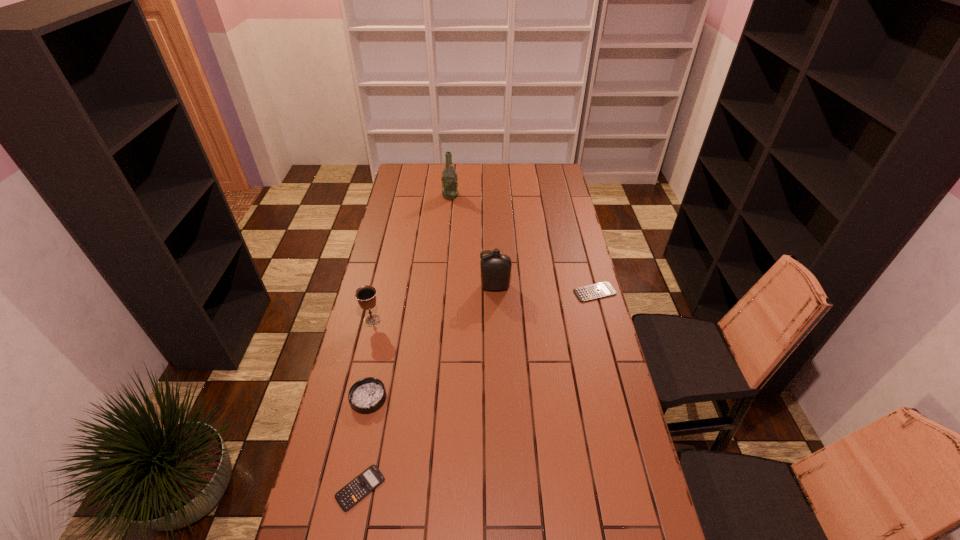
Locate an element on the screen. The height and width of the screenshot is (540, 960). free space between the third shortest object and the second tallest object is located at coordinates (432, 342).

Find the location of a particular element. Image resolution: width=960 pixels, height=540 pixels. blank region between the rightmost object and the ashtray is located at coordinates pyautogui.click(x=482, y=345).

This screenshot has width=960, height=540. Find the location of `blank region between the chalice and the bottle`. blank region between the chalice and the bottle is located at coordinates (434, 303).

Locate an element on the screen. The width and height of the screenshot is (960, 540). unoccupied area between the right calculator and the farthest object is located at coordinates 522,244.

Image resolution: width=960 pixels, height=540 pixels. In order to click on vacant space that's between the second object from right to left and the fifth tallest object in this screenshot , I will do `click(545, 289)`.

Find the location of a particular element. This screenshot has width=960, height=540. free area in between the shorter calculator and the second object from right to left is located at coordinates (428, 387).

The height and width of the screenshot is (540, 960). I want to click on free space between the fourth farthest object and the fourth tallest object, so click(371, 359).

Identify the location of unoccupied area between the ashtray and the beer bottle. The height and width of the screenshot is (540, 960). (410, 297).

Locate an element on the screen. The image size is (960, 540). empty location between the rightmost object and the fourth tallest object is located at coordinates (482, 345).

You are a GUI agent. You are given a task and a screenshot of the screen. Output one action in this format:
    pyautogui.click(x=<x>, y=<y>)
    Task: Click on the object that can be found as the second closest to the second object from right to left
    This screenshot has height=540, width=960.
    Given the screenshot: What is the action you would take?
    pyautogui.click(x=366, y=295)